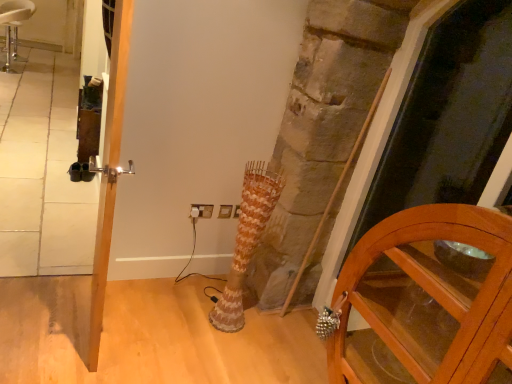
You are a GUI agent. You are given a task and a screenshot of the screen. Output one action in this format:
    pyautogui.click(x=<x>, y=<y>)
    Task: Click on the vacant area that is situated to the right of polished silver door handle at left
    This screenshot has width=512, height=384.
    Given the screenshot: What is the action you would take?
    pyautogui.click(x=154, y=332)